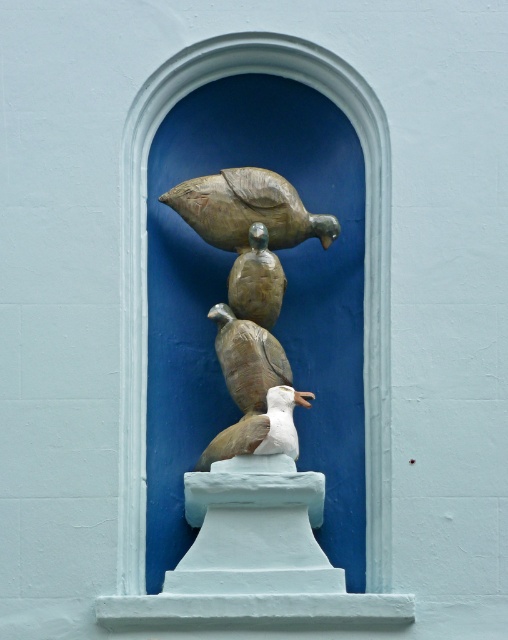
From the picture: You are an art curator planning to photograph the sculpture installation. You need to ensure that the bronze textured bird at center and the white matte bird at center are both visible in the frame. Given their positions, which direction should you position your camera relative to the sculpture to capture both birds in the same shot?

The bronze textured bird at center is to the left of the white matte bird at center. To capture both in the same frame, position the camera so it faces the center of the sculpture, ensuring the camera is aligned to include both the left and right sides where each bird is positioned.